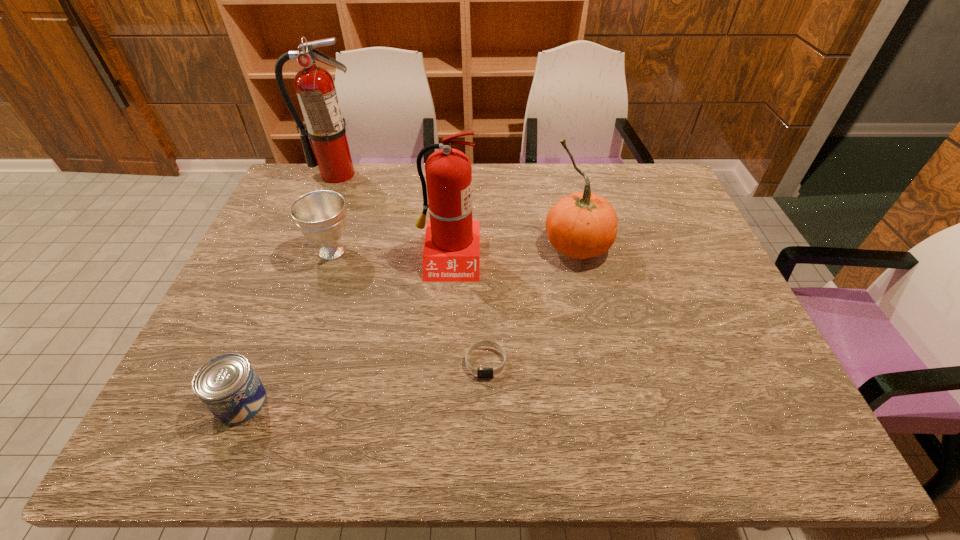
You are a GUI agent. You are given a task and a screenshot of the screen. Output one action in this format:
    pyautogui.click(x=<x>, y=<y>)
    Task: Click on the shortest object
    
    Given the screenshot: What is the action you would take?
    pyautogui.click(x=480, y=372)

You are a GUI agent. You are given a task and a screenshot of the screen. Output one action in this format:
    pyautogui.click(x=<x>, y=<y>)
    Task: Click on the vacant space situated 0.390m on the nozzle side of the taller fire extinguisher
    The image size is (960, 540).
    Given the screenshot: What is the action you would take?
    pyautogui.click(x=300, y=265)

Where is `free space located 0.160m on the front-facing side of the shorter fire extinguisher`? Image resolution: width=960 pixels, height=540 pixels. free space located 0.160m on the front-facing side of the shorter fire extinguisher is located at coordinates (444, 330).

This screenshot has width=960, height=540. In order to click on free space located on the right of the fourth shortest object in this screenshot , I will do `click(660, 246)`.

The height and width of the screenshot is (540, 960). In order to click on vacant point located on the back of the fourth tallest object in this screenshot , I will do `click(355, 185)`.

Identify the location of vacant position located on the front label of the fifth tallest object. Image resolution: width=960 pixels, height=540 pixels. (450, 402).

Where is `free space located 0.120m on the outer surface of the shortest object`? free space located 0.120m on the outer surface of the shortest object is located at coordinates (487, 431).

This screenshot has height=540, width=960. What are the coordinates of `object located at the far edge` in the screenshot? It's located at (315, 87).

Where is `object at the near edge`? object at the near edge is located at coordinates (227, 385).

Find the location of `fire extinguisher that is positioned at the left edge`. fire extinguisher that is positioned at the left edge is located at coordinates (315, 87).